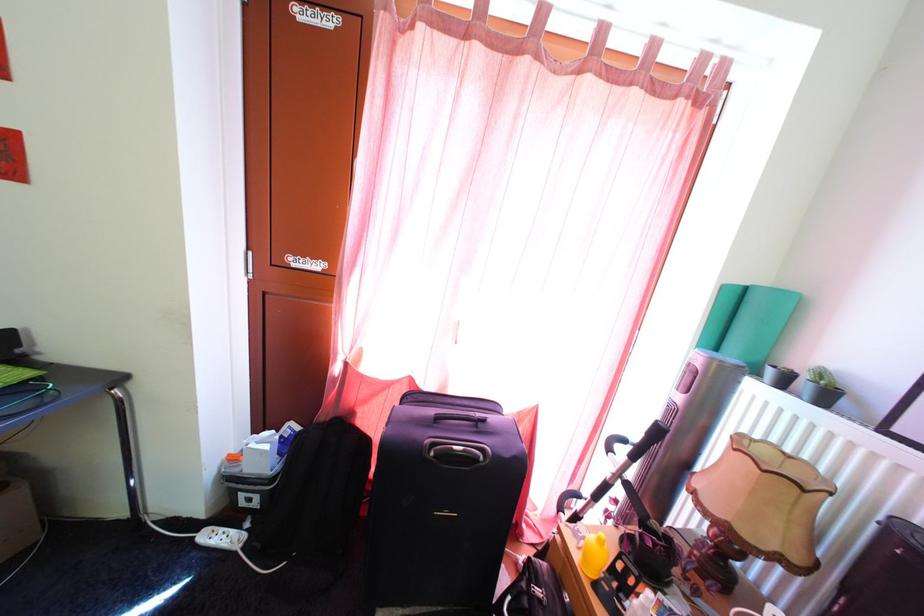
This screenshot has height=616, width=924. What do you see at coordinates (458, 453) in the screenshot?
I see `a black suitcase handle` at bounding box center [458, 453].